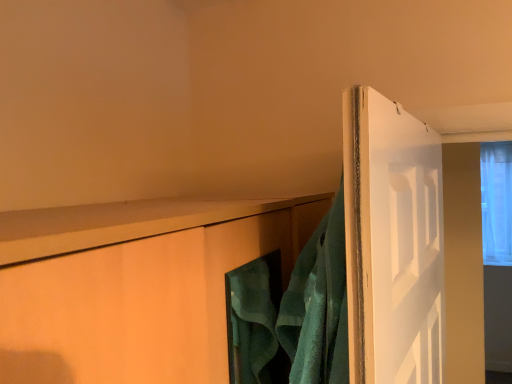
The width and height of the screenshot is (512, 384). What do you see at coordinates (496, 202) in the screenshot?
I see `transparent glass window at upper right` at bounding box center [496, 202].

You are a GUI agent. You are given a task and a screenshot of the screen. Output one action in this format:
    pyautogui.click(x=<x>, y=<y>)
    Task: Click on the transparent glass window at upper right
    This screenshot has width=512, height=384.
    Given the screenshot: What is the action you would take?
    pyautogui.click(x=496, y=202)

Locate an element on the screen. This screenshot has height=384, width=512. green terry cloth towel at upper right is located at coordinates (318, 305).

This screenshot has width=512, height=384. Describe the element at coordinates (318, 305) in the screenshot. I see `green terry cloth towel at upper right` at that location.

Locate an element on the screen. This screenshot has width=512, height=384. transparent glass window at upper right is located at coordinates (496, 202).

From the picture: Considering the positions of objects green terry cloth towel at upper right and transparent glass window at upper right in the image provided, who is more to the right, green terry cloth towel at upper right or transparent glass window at upper right?

From the viewer's perspective, transparent glass window at upper right appears more on the right side.

Considering the relative positions of green terry cloth towel at upper right and transparent glass window at upper right in the image provided, is green terry cloth towel at upper right in front of transparent glass window at upper right?

Yes, green terry cloth towel at upper right is closer to the viewer.

Considering the positions of points (296, 274) and (501, 190), is point (296, 274) farther from camera compared to point (501, 190)?

That is False.

From the image's perspective, who appears lower, green terry cloth towel at upper right or transparent glass window at upper right?

green terry cloth towel at upper right, from the image's perspective.

Based on the photo, from a real-world perspective, does green terry cloth towel at upper right sit lower than transparent glass window at upper right?

Yes, from a real-world perspective, green terry cloth towel at upper right is beneath transparent glass window at upper right.

Is green terry cloth towel at upper right thinner than transparent glass window at upper right?

Indeed, green terry cloth towel at upper right has a lesser width compared to transparent glass window at upper right.

Is green terry cloth towel at upper right shorter than transparent glass window at upper right?

Yes.

Based on their sizes in the image, would you say green terry cloth towel at upper right is bigger or smaller than transparent glass window at upper right?

green terry cloth towel at upper right is smaller than transparent glass window at upper right.

Would you say transparent glass window at upper right is part of green terry cloth towel at upper right's contents?

No, transparent glass window at upper right is located outside of green terry cloth towel at upper right.

Is green terry cloth towel at upper right directly adjacent to transparent glass window at upper right?

No, green terry cloth towel at upper right is not making contact with transparent glass window at upper right.

Is green terry cloth towel at upper right looking in the opposite direction of transparent glass window at upper right?

No, green terry cloth towel at upper right is not facing the opposite direction of transparent glass window at upper right.

Can you tell me how much green terry cloth towel at upper right and transparent glass window at upper right differ in facing direction?

82.6 degrees separate the facing orientations of green terry cloth towel at upper right and transparent glass window at upper right.

The image size is (512, 384). In order to click on window above the green terry cloth towel at upper right (from a real-world perspective) in this screenshot , I will do `click(496, 202)`.

Visually, is transparent glass window at upper right positioned to the left or to the right of green terry cloth towel at upper right?

In the image, transparent glass window at upper right appears on the right side of green terry cloth towel at upper right.

Is transparent glass window at upper right closer to the viewer compared to green terry cloth towel at upper right?

No, transparent glass window at upper right is further to the viewer.

Considering the points (483, 213) and (303, 331), which point is in front, point (483, 213) or point (303, 331)?

The point (303, 331) is closer.

From the image's perspective, is transparent glass window at upper right beneath green terry cloth towel at upper right?

Incorrect, from the image's perspective, transparent glass window at upper right is higher than green terry cloth towel at upper right.

From a real-world perspective, between transparent glass window at upper right and green terry cloth towel at upper right, who is vertically higher?

transparent glass window at upper right, from a real-world perspective.

Considering the sizes of objects transparent glass window at upper right and green terry cloth towel at upper right in the image provided, who is thinner, transparent glass window at upper right or green terry cloth towel at upper right?

green terry cloth towel at upper right.

Considering the sizes of objects transparent glass window at upper right and green terry cloth towel at upper right in the image provided, who is taller, transparent glass window at upper right or green terry cloth towel at upper right?

Standing taller between the two is transparent glass window at upper right.

Who is smaller, transparent glass window at upper right or green terry cloth towel at upper right?

green terry cloth towel at upper right is smaller.

Would you say transparent glass window at upper right is inside or outside green terry cloth towel at upper right?

The correct answer is: outside.

Are transparent glass window at upper right and green terry cloth towel at upper right located far from each other?

Yes.

Is transparent glass window at upper right turned away from green terry cloth towel at upper right?

No.

Image resolution: width=512 pixels, height=384 pixels. There is a green terry cloth towel at upper right. In order to click on window above it (from a real-world perspective) in this screenshot , I will do `click(496, 202)`.

Identify the location of bath towel below the transparent glass window at upper right (from the image's perspective). This screenshot has height=384, width=512. (318, 305).

Where is `window located above the green terry cloth towel at upper right (from a real-world perspective)`? window located above the green terry cloth towel at upper right (from a real-world perspective) is located at coordinates (496, 202).